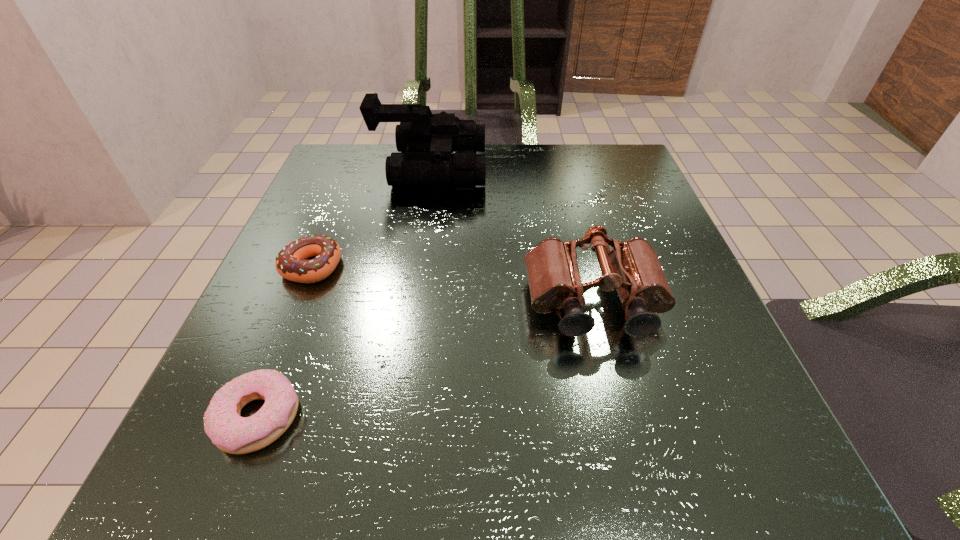
Locate an element on the screen. The height and width of the screenshot is (540, 960). empty space between the rightmost object and the farther doughnut is located at coordinates (453, 285).

What are the coordinates of `free point between the farther doughnut and the farther binoculars` in the screenshot? It's located at (371, 218).

The width and height of the screenshot is (960, 540). Identify the location of vacant space in between the shorter binoculars and the farther doughnut. (453, 285).

The height and width of the screenshot is (540, 960). Find the location of `free space between the taller binoculars and the nearer binoculars`. free space between the taller binoculars and the nearer binoculars is located at coordinates (512, 237).

You are a GUI agent. You are given a task and a screenshot of the screen. Output one action in this format:
    pyautogui.click(x=<x>, y=<y>)
    Task: Click on the object that stands as the second closest to the shorter doughnut
    This screenshot has height=540, width=960.
    Given the screenshot: What is the action you would take?
    pyautogui.click(x=632, y=268)

Locate an element on the screen. The width and height of the screenshot is (960, 540). object that stands as the third closest to the right binoculars is located at coordinates pos(290,263).